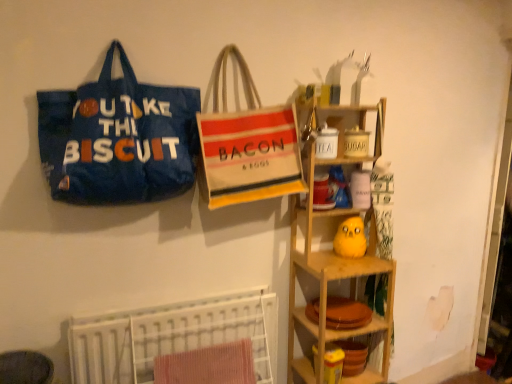
Question: Considering the relative sizes of red textured towel at lower center and blue fabric tote bag at left, the 2th handbag viewed from the right, in the image provided, is red textured towel at lower center bigger than blue fabric tote bag at left, the 2th handbag viewed from the right,?

Choices:
 (A) yes
 (B) no

Answer: (B)

Question: Is red textured towel at lower center not within blue fabric tote bag at left, placed as the 1th handbag when sorted from left to right?

Choices:
 (A) no
 (B) yes

Answer: (B)

Question: Is red textured towel at lower center touching blue fabric tote bag at left, placed as the 1th handbag when sorted from left to right?

Choices:
 (A) no
 (B) yes

Answer: (A)

Question: Is red textured towel at lower center aimed at blue fabric tote bag at left, placed as the 1th handbag when sorted from left to right?

Choices:
 (A) yes
 (B) no

Answer: (B)

Question: From a real-world perspective, is red textured towel at lower center on blue fabric tote bag at left, placed as the 1th handbag when sorted from left to right?

Choices:
 (A) yes
 (B) no

Answer: (B)

Question: In terms of height, does beige canvas tote bag at center, acting as the 1th handbag starting from the right, look taller or shorter compared to white textured bed at lower left?

Choices:
 (A) short
 (B) tall

Answer: (B)

Question: From the image's perspective, is beige canvas tote bag at center, acting as the 1th handbag starting from the right, located above or below white textured bed at lower left?

Choices:
 (A) above
 (B) below

Answer: (A)

Question: Is beige canvas tote bag at center, positioned as the second handbag in left-to-right order, situated inside white textured bed at lower left or outside?

Choices:
 (A) outside
 (B) inside

Answer: (A)

Question: From a real-world perspective, is beige canvas tote bag at center, positioned as the second handbag in left-to-right order, physically located above or below white textured bed at lower left?

Choices:
 (A) below
 (B) above

Answer: (B)

Question: Considering the positions of blue fabric tote bag at left, the 2th handbag viewed from the right, and red textured towel at lower center in the image, is blue fabric tote bag at left, the 2th handbag viewed from the right, wider or thinner than red textured towel at lower center?

Choices:
 (A) wide
 (B) thin

Answer: (A)

Question: Considering the positions of blue fabric tote bag at left, placed as the 1th handbag when sorted from left to right, and red textured towel at lower center in the image, is blue fabric tote bag at left, placed as the 1th handbag when sorted from left to right, taller or shorter than red textured towel at lower center?

Choices:
 (A) short
 (B) tall

Answer: (B)

Question: Based on their sizes in the image, would you say blue fabric tote bag at left, placed as the 1th handbag when sorted from left to right, is bigger or smaller than red textured towel at lower center?

Choices:
 (A) big
 (B) small

Answer: (A)

Question: From a real-world perspective, relative to red textured towel at lower center, is blue fabric tote bag at left, the 2th handbag viewed from the right, vertically above or below?

Choices:
 (A) below
 (B) above

Answer: (B)

Question: From a real-world perspective, is white textured bed at lower left positioned above or below beige canvas tote bag at center, acting as the 1th handbag starting from the right?

Choices:
 (A) below
 (B) above

Answer: (A)

Question: Considering the positions of white textured bed at lower left and beige canvas tote bag at center, positioned as the second handbag in left-to-right order, in the image, is white textured bed at lower left wider or thinner than beige canvas tote bag at center, positioned as the second handbag in left-to-right order,?

Choices:
 (A) wide
 (B) thin

Answer: (B)